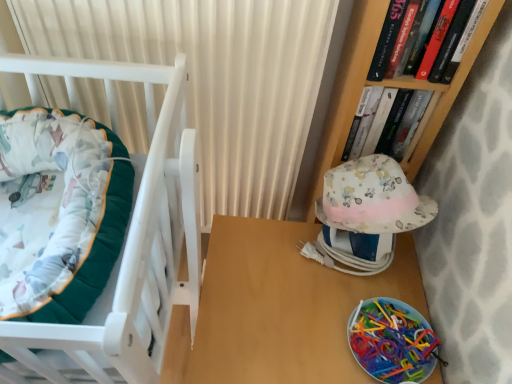
Locate an element on the screen. This screenshot has width=512, height=384. vacant area to the left of fluffy cotton hat at right is located at coordinates (265, 255).